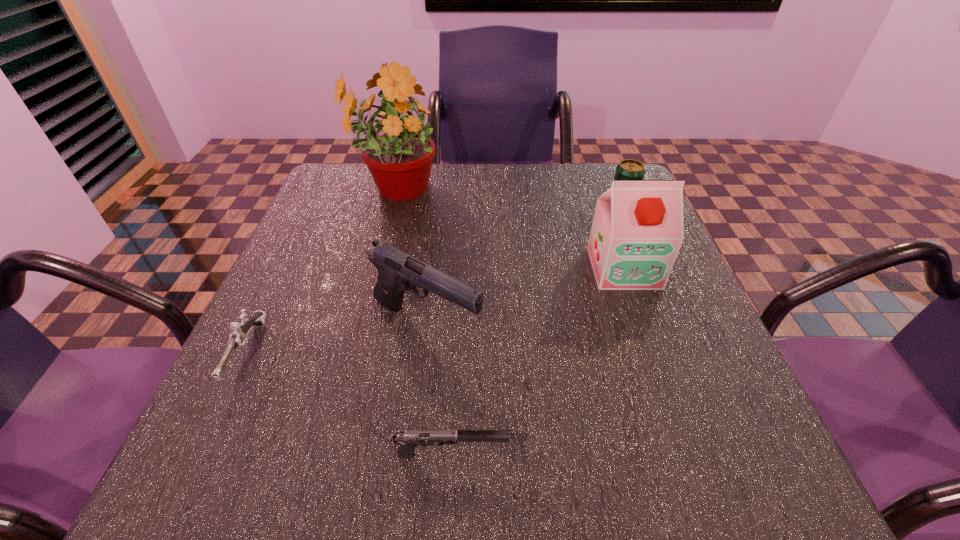
Locate an element on the screen. This screenshot has height=540, width=960. free location that satisfies the following two spatial constraints: 1. with the cap open on the soya milk; 2. at the muzzle of the tallest gun is located at coordinates (644, 326).

Image resolution: width=960 pixels, height=540 pixels. What are the coordinates of `vacant area in the image that satisfies the following two spatial constraints: 1. on the front side of the beer can; 2. at the muzzle of the tallest gun` in the screenshot? It's located at (676, 326).